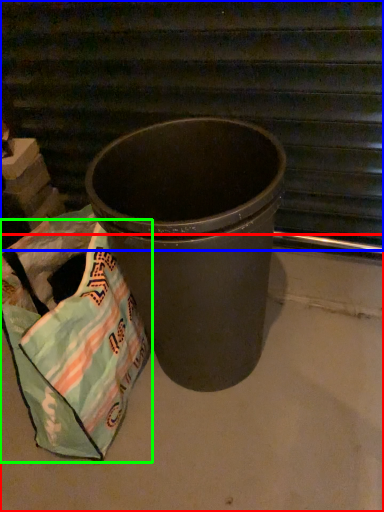
Question: Which object is the closest to the concrete (highlighted by a red box)? Choose among these: stairwell (highlighted by a blue box) or grocery bag (highlighted by a green box).

Choices:
 (A) stairwell
 (B) grocery bag

Answer: (B)